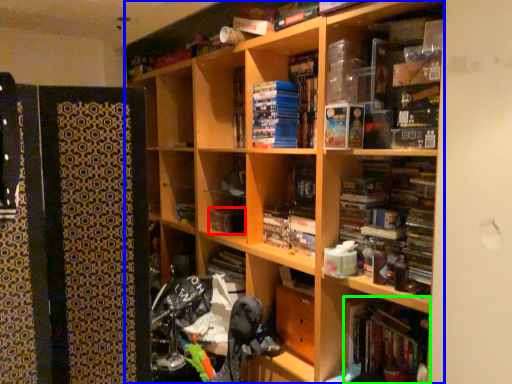
Question: Which object is the closest to the book (highlighted by a red box)? Choose among these: bookcase (highlighted by a blue box) or book (highlighted by a green box).

Choices:
 (A) bookcase
 (B) book

Answer: (A)